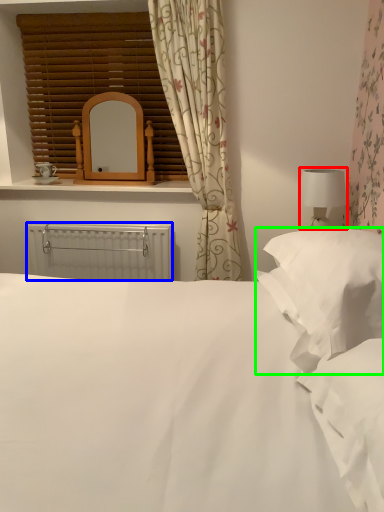
Question: Estimate the real-world distances between objects in this image. Which object is closer to table lamp (highlighted by a red box), radiator (highlighted by a blue box) or pillow (highlighted by a green box)?

Choices:
 (A) radiator
 (B) pillow

Answer: (B)